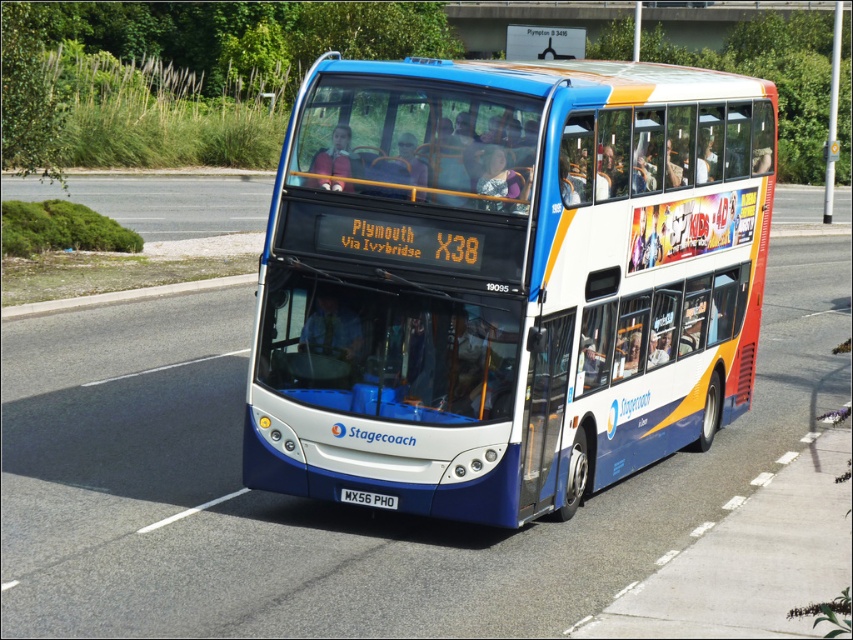
Question: Where is blue metallic bus at center located in relation to white plastic license plate at center in the image?

Choices:
 (A) right
 (B) left

Answer: (A)

Question: Which of the following is the farthest from the observer?

Choices:
 (A) blue metallic bus at center
 (B) white plastic license plate at center

Answer: (B)

Question: Can you confirm if blue metallic bus at center is positioned to the left of white plastic license plate at center?

Choices:
 (A) yes
 (B) no

Answer: (B)

Question: Among these points, which one is nearest to the camera?

Choices:
 (A) (329, 80)
 (B) (346, 492)

Answer: (A)

Question: Is blue metallic bus at center thinner than white plastic license plate at center?

Choices:
 (A) no
 (B) yes

Answer: (B)

Question: Among these points, which one is nearest to the camera?

Choices:
 (A) (387, 502)
 (B) (404, 456)

Answer: (B)